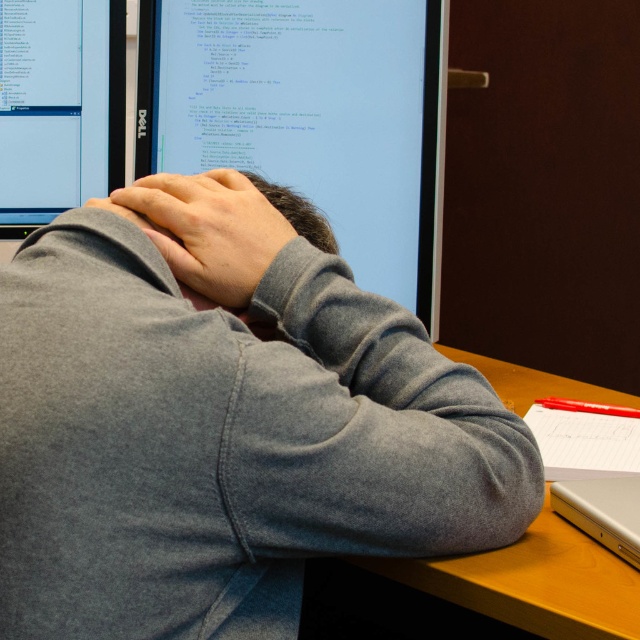
Question: Among these points, which one is farthest from the camera?

Choices:
 (A) (362, 54)
 (B) (484, 605)
 (C) (19, 108)

Answer: (C)

Question: Is matte black monitor at center smaller than wooden at center?

Choices:
 (A) yes
 (B) no

Answer: (B)

Question: Does gray fleece sweatshirt at upper center have a lesser width compared to matte black monitor at center?

Choices:
 (A) yes
 (B) no

Answer: (B)

Question: Which of these objects is positioned farthest from the gray fleece at center?

Choices:
 (A) wooden at center
 (B) gray fleece sweatshirt at upper center
 (C) matte black monitor at center

Answer: (C)

Question: Does gray fleece sweatshirt at upper center have a smaller size compared to silver metallic laptop at lower right?

Choices:
 (A) no
 (B) yes

Answer: (A)

Question: Which of the following is the farthest from the observer?

Choices:
 (A) pos(561,618)
 (B) pos(406,180)
 (C) pos(625,557)

Answer: (B)